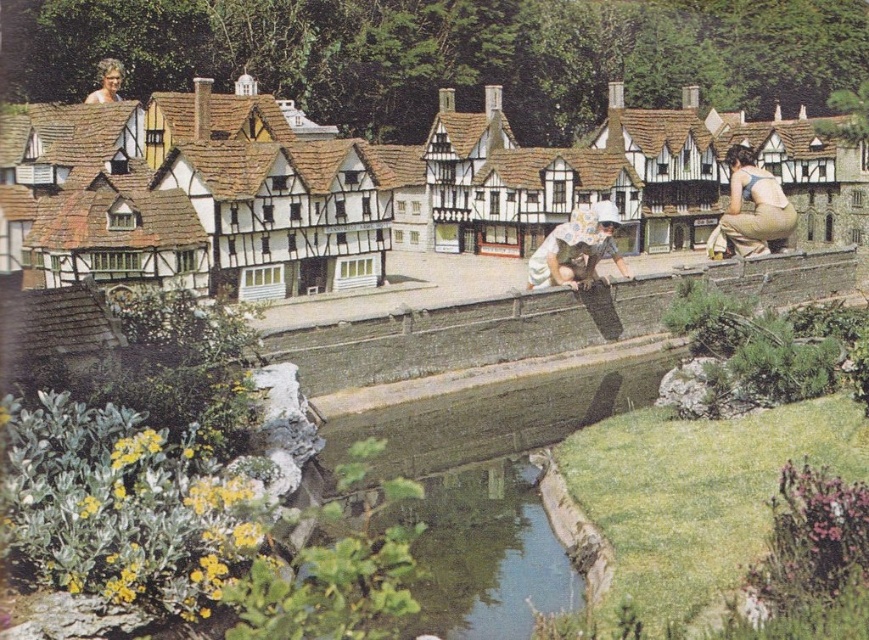
You are a visitor in this village scene. You notice a person wearing light brown fabric overalls at right and another person with blonde hair at upper left. From your viewpoint, which person is positioned lower in the scene?

The light brown fabric overalls at right is below blonde hair at upper left, so the person wearing light brown fabric overalls at right is positioned lower in the scene.

You are a photographer standing in front of the miniature village model. You want to capture a closeup shot of the floral fabric dress at center. However, your camera has a maximum focus range of 60 meters. Can you focus on the dress from your current position?

The floral fabric dress at center is 63.82 meters away from the camera. Since your camera can only focus up to 60 meters, you cannot focus on the dress from your current position.

You are a visitor in the village and want to take a photo that includes both the light brown fabric overalls at right and the blonde hair at upper left. Which object should be positioned closer to the camera to ensure both are in focus?

To ensure both the light brown fabric overalls at right and the blonde hair at upper left are in focus, position the light brown fabric overalls at right closer to the camera since it is taller than the blonde hair at upper left, allowing for better depth of field coverage.